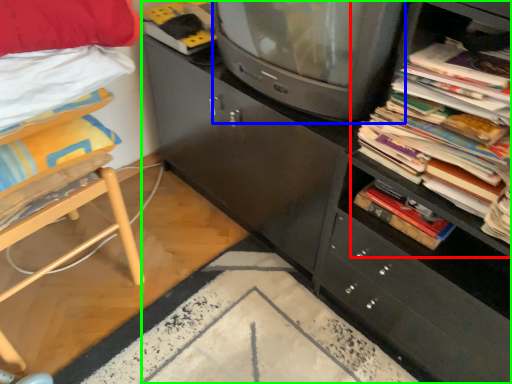
Question: Which is nearer to the shelf (highlighted by a red box)? television (highlighted by a blue box) or cabinetry (highlighted by a green box).

Choices:
 (A) television
 (B) cabinetry

Answer: (A)